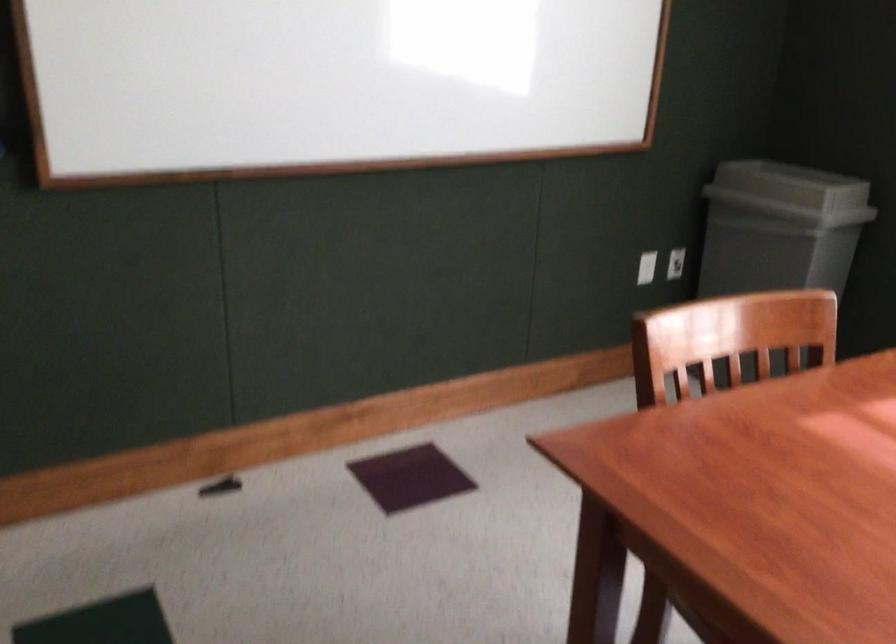
Locate an element on the screen. Image resolution: width=896 pixels, height=644 pixels. trash can lid is located at coordinates (791, 185).